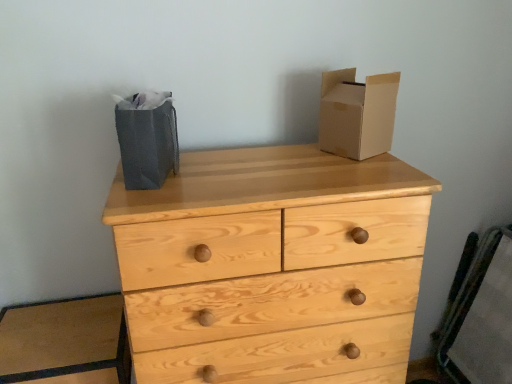
Image resolution: width=512 pixels, height=384 pixels. What are the coordinates of `cardboard box at upper right` in the screenshot? It's located at (357, 113).

Image resolution: width=512 pixels, height=384 pixels. I want to click on natural wood chest of drawers at center, so click(272, 267).

This screenshot has height=384, width=512. Describe the element at coordinates (481, 317) in the screenshot. I see `wooden chair at right` at that location.

The image size is (512, 384). Find the location of `gray paper bag at left`. gray paper bag at left is located at coordinates (147, 138).

This screenshot has width=512, height=384. What do you see at coordinates (147, 138) in the screenshot? I see `gray paper bag at left` at bounding box center [147, 138].

This screenshot has width=512, height=384. I want to click on cardboard box at upper right, so click(x=357, y=113).

Could you tell me if natural wood chest of drawers at center is facing gray paper bag at left?

No, natural wood chest of drawers at center is not aimed at gray paper bag at left.

From the image's perspective, does natural wood chest of drawers at center appear higher than gray paper bag at left?

No, from the image's perspective, natural wood chest of drawers at center is not above gray paper bag at left.

Which is correct: natural wood chest of drawers at center is inside gray paper bag at left, or outside of it?

natural wood chest of drawers at center exists outside the volume of gray paper bag at left.

Looking at their sizes, would you say natural wood chest of drawers at center is wider or thinner than gray paper bag at left?

Considering their sizes, natural wood chest of drawers at center looks broader than gray paper bag at left.

Is cardboard box at upper right inside or outside of natural wood chest of drawers at center?

cardboard box at upper right cannot be found inside natural wood chest of drawers at center.

Identify the location of cardboard box to the right of natural wood chest of drawers at center. (357, 113).

Does cardboard box at upper right have a greater width compared to natural wood chest of drawers at center?

No, cardboard box at upper right is not wider than natural wood chest of drawers at center.

Is cardboard box at upper right bigger or smaller than natural wood chest of drawers at center?

Clearly, cardboard box at upper right is smaller in size than natural wood chest of drawers at center.

Can you tell me how much natural wood chest of drawers at center and cardboard box at upper right differ in facing direction?

63.9 degrees.

Is natural wood chest of drawers at center oriented towards cardboard box at upper right?

No, natural wood chest of drawers at center is not oriented towards cardboard box at upper right.

Does natural wood chest of drawers at center have a lesser width compared to cardboard box at upper right?

No, natural wood chest of drawers at center is not thinner than cardboard box at upper right.

From a real-world perspective, who is located higher, natural wood chest of drawers at center or cardboard box at upper right?

In real-world perspective, cardboard box at upper right is above.

Is point (447, 360) farther from camera compared to point (164, 153)?

Yes.

Locate an element on the screen. The image size is (512, 384). chair on the right of the gray paper bag at left is located at coordinates (481, 317).

How many degrees apart are the facing directions of wooden chair at right and gray paper bag at left?

There is a 77.5-degree angle between the facing directions of wooden chair at right and gray paper bag at left.

Looking at this image, is wooden chair at right at the right side of gray paper bag at left?

Yes.

In the image, is gray paper bag at left positioned in front of or behind cardboard box at upper right?

gray paper bag at left is positioned closer to the viewer than cardboard box at upper right.

From the image's perspective, would you say gray paper bag at left is positioned over cardboard box at upper right?

No, from the image's perspective, gray paper bag at left is not above cardboard box at upper right.

Does gray paper bag at left have a lesser width compared to cardboard box at upper right?

No, gray paper bag at left is not thinner than cardboard box at upper right.

Is gray paper bag at left facing away from cardboard box at upper right?

No.

What's the angular difference between gray paper bag at left and natural wood chest of drawers at center's facing directions?

The angle between the facing direction of gray paper bag at left and the facing direction of natural wood chest of drawers at center is 12.5 degrees.

Is gray paper bag at left wider than natural wood chest of drawers at center?

No.

Is gray paper bag at left located outside natural wood chest of drawers at center?

gray paper bag at left lies outside natural wood chest of drawers at center's area.

Does point (132, 189) lie behind point (148, 285)?

Yes, point (132, 189) is farther from viewer.

From the image's perspective, is wooden chair at right located above or below natural wood chest of drawers at center?

wooden chair at right is below natural wood chest of drawers at center.

Is wooden chair at right at the right side of natural wood chest of drawers at center?

Yes.

Can you tell me how much wooden chair at right and natural wood chest of drawers at center differ in facing direction?

wooden chair at right and natural wood chest of drawers at center are facing 90 degrees away from each other.

Find the location of a particular element. shopping bag above the natural wood chest of drawers at center (from the image's perspective) is located at coordinates (147, 138).

At what (x,y) coordinates should I click in order to perform the action: click on chest of drawers in front of the cardboard box at upper right. Please return your answer as a coordinate pair (x, y). Image resolution: width=512 pixels, height=384 pixels. Looking at the image, I should click on (272, 267).

Based on their spatial positions, is cardboard box at upper right or natural wood chest of drawers at center closer to wooden chair at right?

The object closer to wooden chair at right is natural wood chest of drawers at center.

When comparing their distances from gray paper bag at left, does natural wood chest of drawers at center or cardboard box at upper right seem closer?

natural wood chest of drawers at center lies closer to gray paper bag at left than the other object.

Based on their spatial positions, is gray paper bag at left or natural wood chest of drawers at center further from cardboard box at upper right?

The object further to cardboard box at upper right is gray paper bag at left.

Estimate the real-world distances between objects in this image. Which object is further from natural wood chest of drawers at center, gray paper bag at left or cardboard box at upper right?

The object further to natural wood chest of drawers at center is gray paper bag at left.

Based on their spatial positions, is wooden chair at right or cardboard box at upper right further from gray paper bag at left?

The object further to gray paper bag at left is wooden chair at right.

Considering their positions, is cardboard box at upper right positioned further to gray paper bag at left than natural wood chest of drawers at center?

Based on the image, cardboard box at upper right appears to be further to gray paper bag at left.

Based on their spatial positions, is cardboard box at upper right or gray paper bag at left closer to natural wood chest of drawers at center?

Based on the image, cardboard box at upper right appears to be nearer to natural wood chest of drawers at center.

When comparing their distances from wooden chair at right, does cardboard box at upper right or gray paper bag at left seem further?

gray paper bag at left lies further to wooden chair at right than the other object.

I want to click on chest of drawers between gray paper bag at left and wooden chair at right, so click(272, 267).

Locate an element on the screen. shopping bag between cardboard box at upper right and natural wood chest of drawers at center in the up-down direction is located at coordinates (147, 138).

Find the location of a particular element. The width and height of the screenshot is (512, 384). cardboard box between natural wood chest of drawers at center and wooden chair at right is located at coordinates (357, 113).

Locate an element on the screen. This screenshot has height=384, width=512. cardboard box between gray paper bag at left and wooden chair at right is located at coordinates (357, 113).